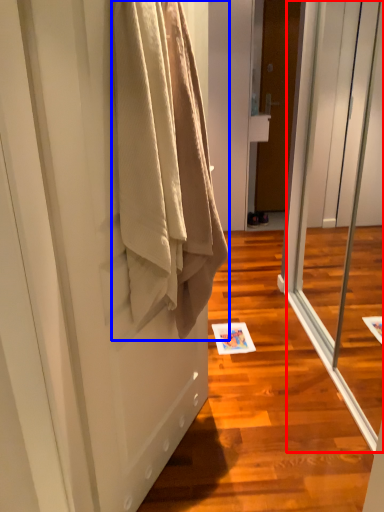
Question: Among these objects, which one is nearest to the camera, screen door (highlighted by a red box) or towel (highlighted by a blue box)?

Choices:
 (A) screen door
 (B) towel

Answer: (B)